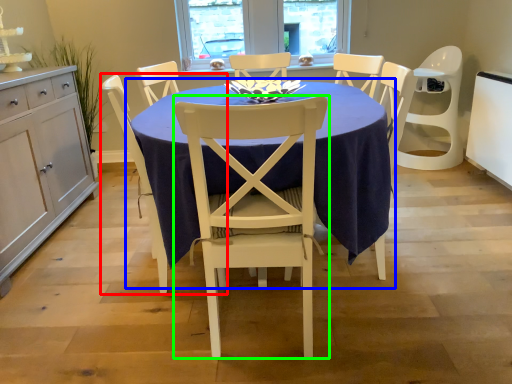
Question: Estimate the real-world distances between objects in this image. Which object is closer to chair (highlighted by a red box), kitchen & dining room table (highlighted by a blue box) or chair (highlighted by a green box)?

Choices:
 (A) kitchen & dining room table
 (B) chair

Answer: (B)